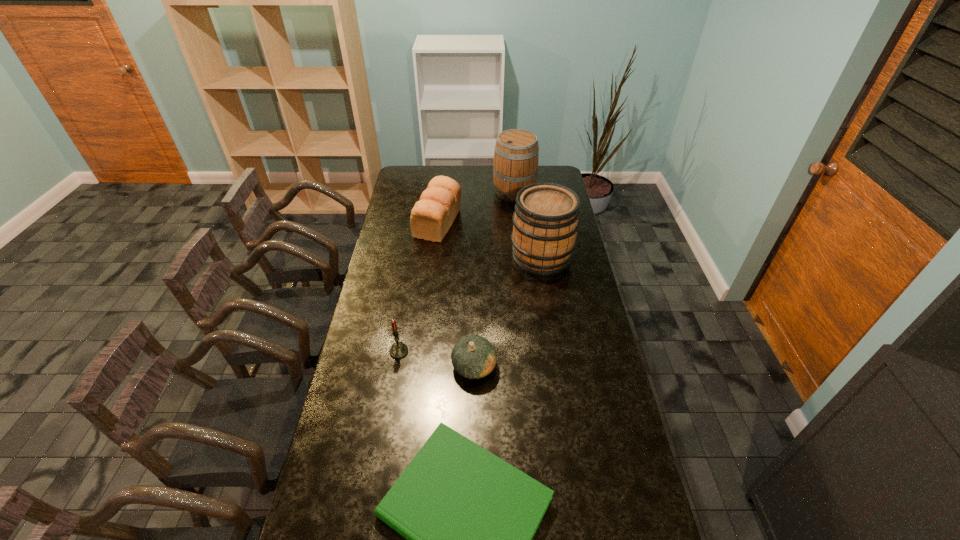
Identify the location of free space between the gourd and the farthest object. (494, 279).

Locate an element on the screen. This screenshot has height=540, width=960. unoccupied area between the gourd and the farthest object is located at coordinates (494, 279).

Locate which object ranks fifth in proximity to the candle. Please provide its 2D coordinates. Your answer should be formatted as a tuple, i.e. [(x, y)], where the tuple contains the x and y coordinates of a point satisfying the conditions above.

[(516, 155)]

Identify which object is the second nearest to the gourd. Please provide its 2D coordinates. Your answer should be formatted as a tuple, i.e. [(x, y)], where the tuple contains the x and y coordinates of a point satisfying the conditions above.

[(398, 350)]

Image resolution: width=960 pixels, height=540 pixels. I want to click on vacant space that satisfies the following two spatial constraints: 1. on the front side of the bread; 2. on the left side of the nearer cider, so click(x=434, y=256).